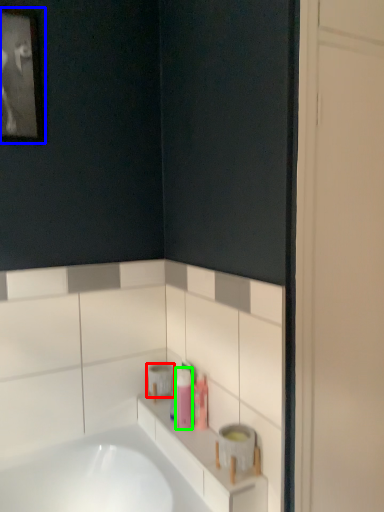
Question: Estimate the real-world distances between objects in this image. Which object is closer to toilet paper (highlighted by a red box), picture frame (highlighted by a blue box) or toiletry (highlighted by a green box)?

Choices:
 (A) picture frame
 (B) toiletry

Answer: (B)